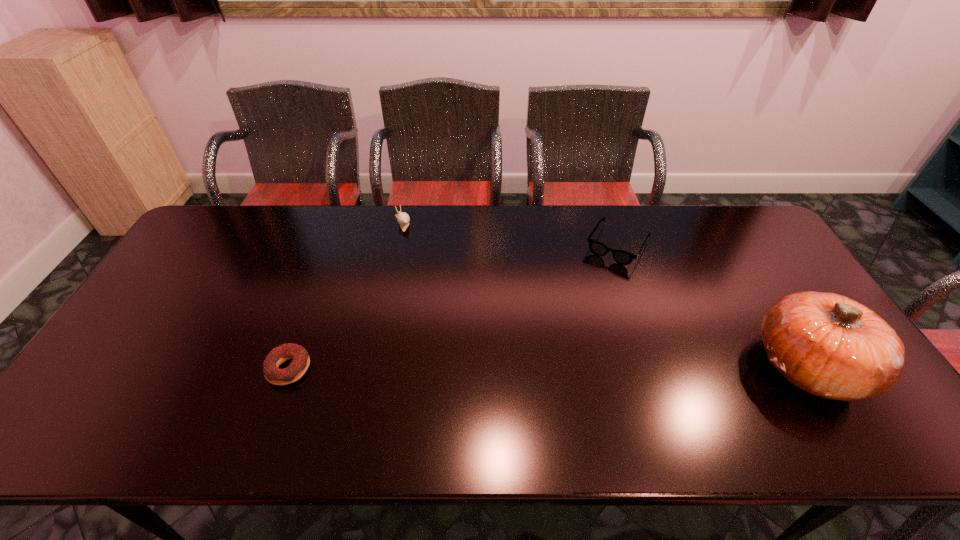
In the image, there is a desktop. Where is `vacant area at the near edge`? The image size is (960, 540). vacant area at the near edge is located at coordinates (754, 379).

Where is `vacant space at the left edge`? vacant space at the left edge is located at coordinates (156, 350).

In the image, there is a desktop. What are the coordinates of `free region at the right edge` in the screenshot? It's located at (795, 279).

The image size is (960, 540). I want to click on free region at the far right corner of the desktop, so click(x=710, y=214).

The width and height of the screenshot is (960, 540). I want to click on free region at the near right corner of the desktop, so click(x=866, y=403).

Where is `vacant area between the doughnut and the spectacles`? vacant area between the doughnut and the spectacles is located at coordinates (453, 307).

You are a GUI agent. You are given a task and a screenshot of the screen. Output one action in this format:
    pyautogui.click(x=<x>, y=<y>)
    Task: Click on the vacant area between the doughnut and the rightmost object
    
    Given the screenshot: What is the action you would take?
    pyautogui.click(x=548, y=367)

Image resolution: width=960 pixels, height=540 pixels. Identify the location of free space between the tallest object and the escargot. (605, 294).

I want to click on free space between the spectacles and the leftmost object, so pyautogui.click(x=453, y=307).

Find the location of a particular element. The image size is (960, 540). unoccupied position between the third object from right to left and the leftmost object is located at coordinates (346, 295).